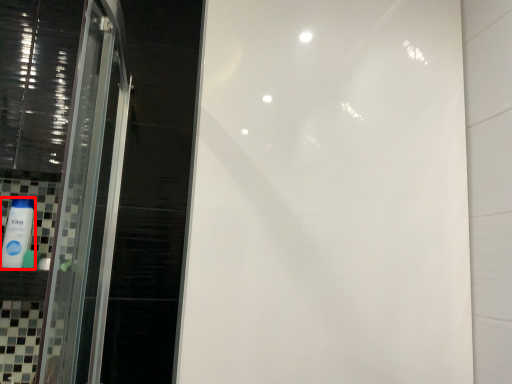
Question: From the image's perspective, what is the correct spatial relationship of mouthwash (annotated by the red box) in relation to toiletry?

Choices:
 (A) above
 (B) below

Answer: (A)